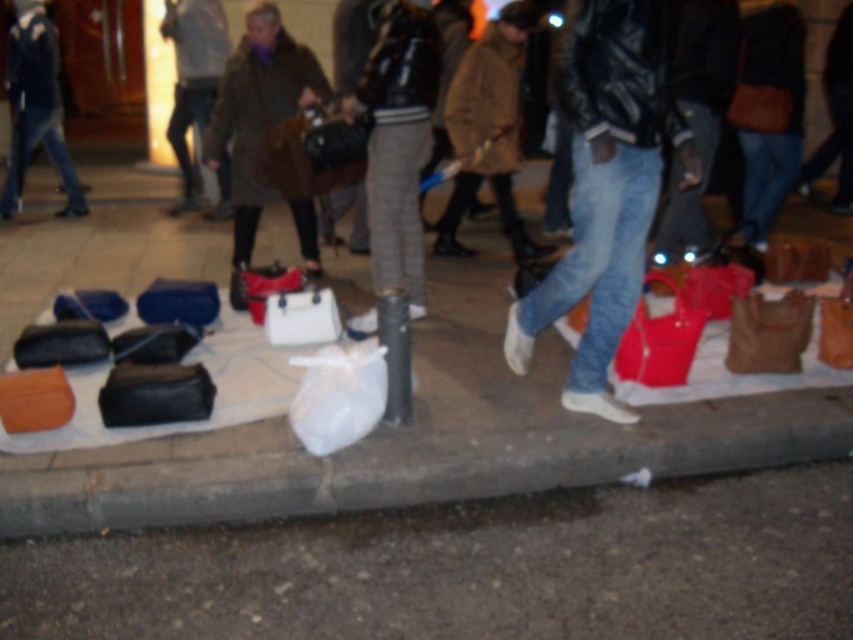
You are a customer looking to pick up the brown leather handbag at right from the display. Will you need to move the white plastic bag at lower center first?

Yes, you will need to move the white plastic bag at lower center first because it is positioned under the brown leather handbag at right, so removing it would allow easier access to the handbag.

You are a street vendor who wants to rearrange your items to make more space for new products. You have a white plastic bag at lower center and a brown leather handbag at right. Which item should you move to free up more space?

You should move the brown leather handbag at right because it occupies more space than the white plastic bag at lower center, freeing up more space for new items.